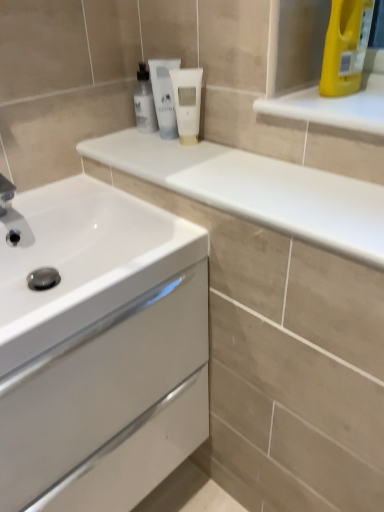
I want to click on free location in front of white matte tube at center, which appears as the second mouthwash when viewed from the right, so click(176, 157).